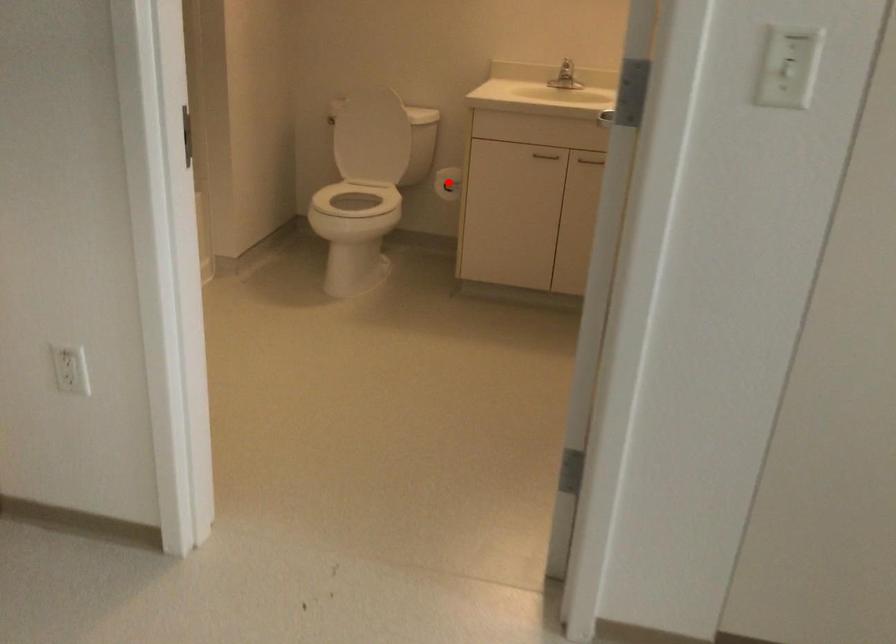
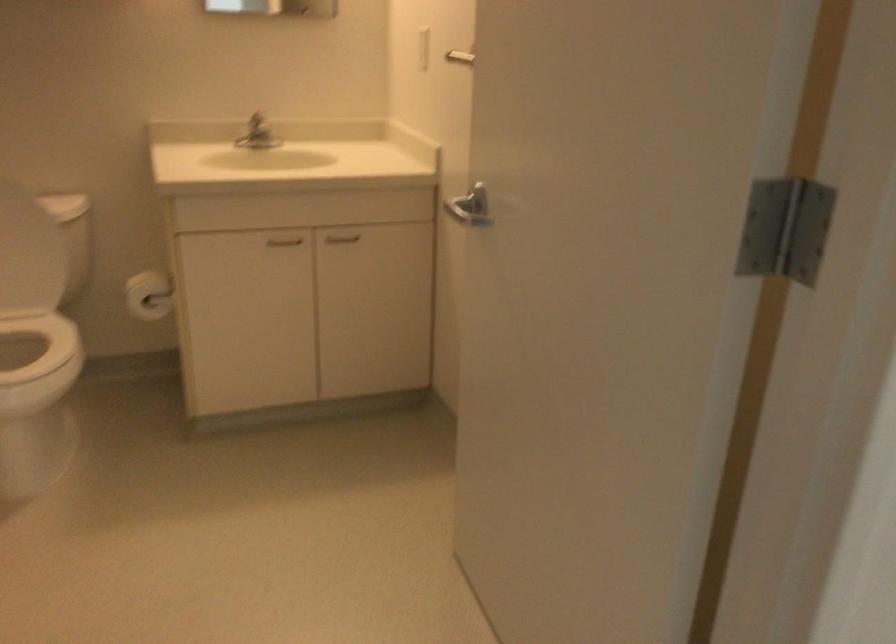
Locate, in the second image, the point that corresponds to the highlighted location in the first image.

(149, 295)